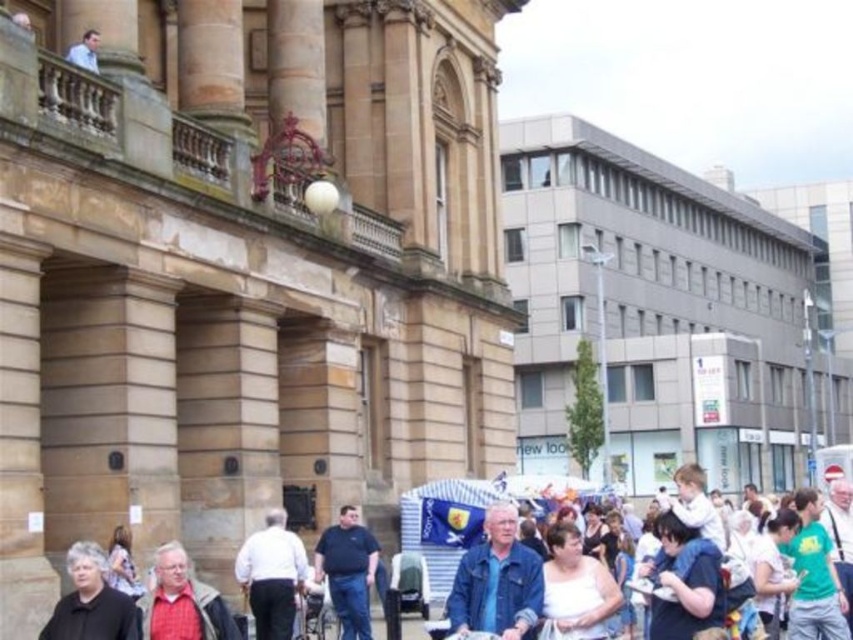
Question: Can you confirm if denim jacket at center is smaller than white shirt at center?

Choices:
 (A) yes
 (B) no

Answer: (B)

Question: Is white shirt at center positioned at the back of white cotton shirt at lower left?

Choices:
 (A) no
 (B) yes

Answer: (B)

Question: Is red plaid shirt at lower left smaller than white cotton shirt at lower left?

Choices:
 (A) yes
 (B) no

Answer: (A)

Question: Among these objects, which one is farthest from the camera?

Choices:
 (A) denim jacket at center
 (B) white cotton shirt at lower right
 (C) red plaid shirt at lower left

Answer: (A)

Question: Among these points, which one is nearest to the camera?

Choices:
 (A) (451, 614)
 (B) (169, 605)

Answer: (B)

Question: Estimate the real-world distances between objects in this image. Which object is closer to the light blue shirt at upper left?

Choices:
 (A) white cotton shirt at lower right
 (B) white shirt at center
 (C) red plaid shirt at lower left
 (D) white cotton shirt at lower left

Answer: (D)